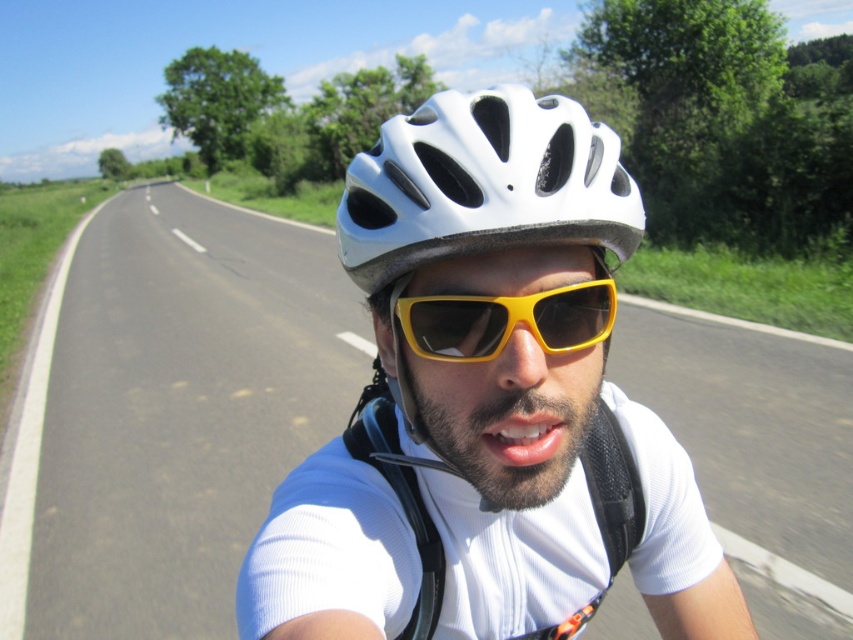
Is the position of white matte helmet at center less distant than that of white matte bicycle helmet at center?

Yes.

From the picture: Can you confirm if white matte helmet at center is thinner than white matte bicycle helmet at center?

In fact, white matte helmet at center might be wider than white matte bicycle helmet at center.

I want to click on white matte helmet at center, so tap(486, 404).

Which is behind, point (476, 444) or point (419, 300)?

The point (476, 444) is behind.

Does white matte helmet at center appear on the left side of yellow matte/glossy goggles at center?

Indeed, white matte helmet at center is positioned on the left side of yellow matte/glossy goggles at center.

Is point (492, 128) farther from viewer compared to point (403, 300)?

No, it is in front of (403, 300).

Where is `white matte helmet at center`? The image size is (853, 640). white matte helmet at center is located at coordinates (486, 404).

Between white matte bicycle helmet at center and yellow matte/glossy goggles at center, which one is positioned lower?

yellow matte/glossy goggles at center is below.

Does point (482, 100) lie behind point (409, 339)?

Yes.

Where is `white matte bicycle helmet at center`? The height and width of the screenshot is (640, 853). white matte bicycle helmet at center is located at coordinates (483, 182).